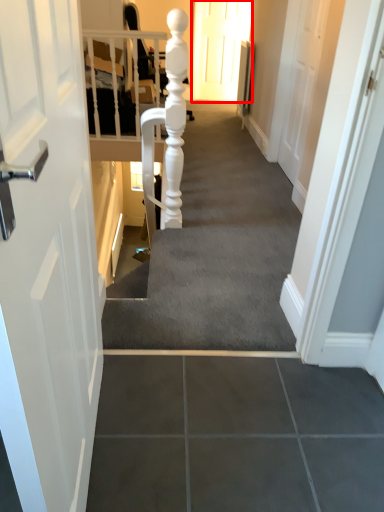
Question: From the image's perspective, what is the correct spatial positioning of door (annotated by the red box) in reference to stairwell?

Choices:
 (A) below
 (B) above

Answer: (B)